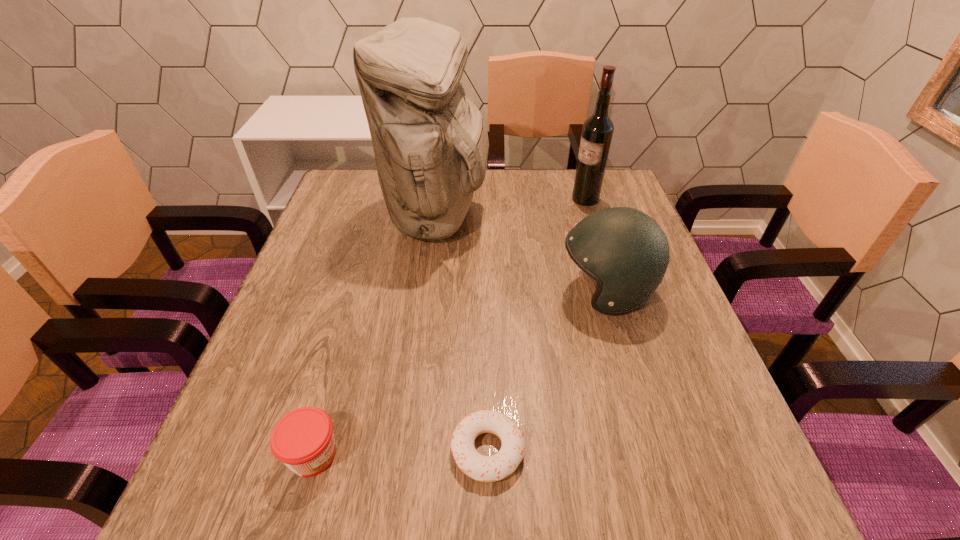
Locate an element on the screen. Image resolution: width=960 pixels, height=540 pixels. football helmet present at the right edge is located at coordinates (626, 252).

Find the location of a particular element. This screenshot has width=960, height=540. object present at the near left corner is located at coordinates [303, 439].

Locate an element on the screen. The width and height of the screenshot is (960, 540). object located at the far right corner is located at coordinates pyautogui.click(x=597, y=132).

Locate an element on the screen. free region at the far edge of the desktop is located at coordinates (497, 194).

Locate an element on the screen. The image size is (960, 540). free point at the near edge is located at coordinates (634, 507).

The height and width of the screenshot is (540, 960). In the image, there is a desktop. Find the location of `vacant space at the left edge`. vacant space at the left edge is located at coordinates (335, 215).

This screenshot has height=540, width=960. I want to click on vacant space at the right edge, so click(x=651, y=452).

Image resolution: width=960 pixels, height=540 pixels. In order to click on vacant space at the near left corner of the desktop in this screenshot , I will do `click(247, 508)`.

The height and width of the screenshot is (540, 960). What are the coordinates of `free spot between the jam and the wine bottle` in the screenshot? It's located at (449, 327).

Locate an element on the screen. vacant space in between the football helmet and the doughnut is located at coordinates (546, 370).